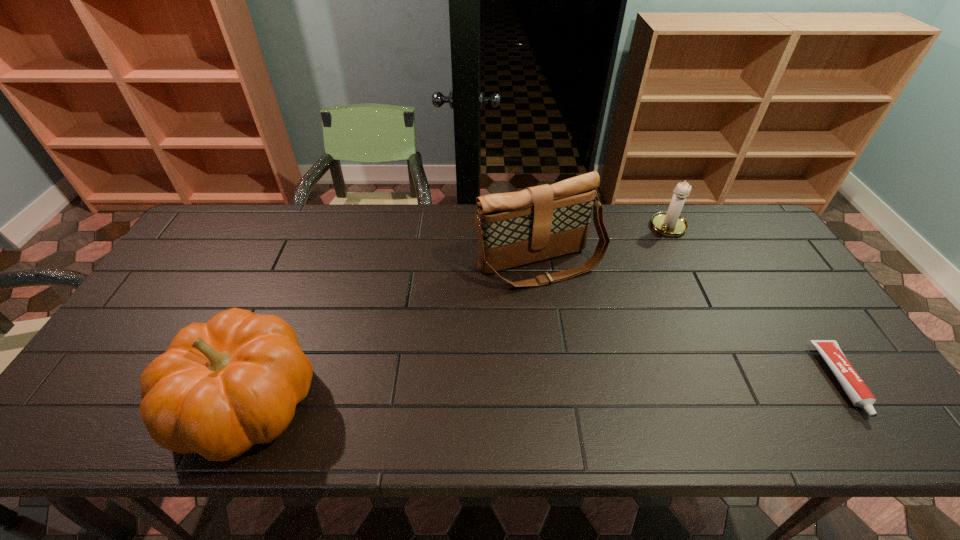
Find the location of a particular element. free space located 0.160m on the front-facing side of the second farthest object is located at coordinates (595, 331).

The image size is (960, 540). I want to click on free space located on the handle side of the farthest object, so click(x=624, y=291).

The image size is (960, 540). Identify the location of free point located on the handle side of the farthest object. (636, 273).

This screenshot has height=540, width=960. Identify the location of vacant space located 0.400m on the handle side of the farthest object. (609, 312).

Image resolution: width=960 pixels, height=540 pixels. Find the location of `shoulder bag at the far edge`. shoulder bag at the far edge is located at coordinates (516, 228).

Find the location of a particular element. candle holder present at the far edge is located at coordinates point(670,223).

What are the coordinates of `pumpkin located in the near edge section of the desktop` in the screenshot? It's located at (221, 387).

At what (x,y) coordinates should I click in order to perform the action: click on toothpaste that is at the near edge. Please return your answer as a coordinate pair (x, y). Looking at the image, I should click on (857, 391).

The height and width of the screenshot is (540, 960). In order to click on object at the right edge in this screenshot , I will do `click(857, 391)`.

At what (x,y) coordinates should I click in order to perform the action: click on object that is at the near right corner. Please return your answer as a coordinate pair (x, y). Looking at the image, I should click on (857, 391).